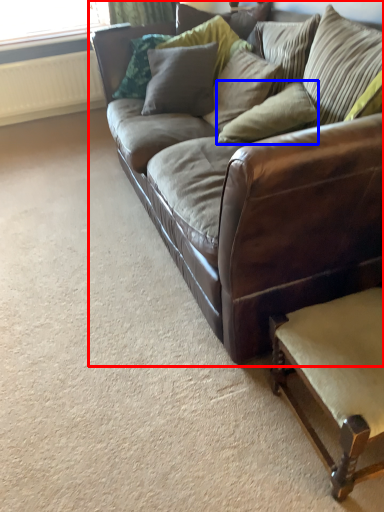
Question: Which object appears closest to the camera in this image, studio couch (highlighted by a red box) or pillow (highlighted by a blue box)?

Choices:
 (A) studio couch
 (B) pillow

Answer: (A)